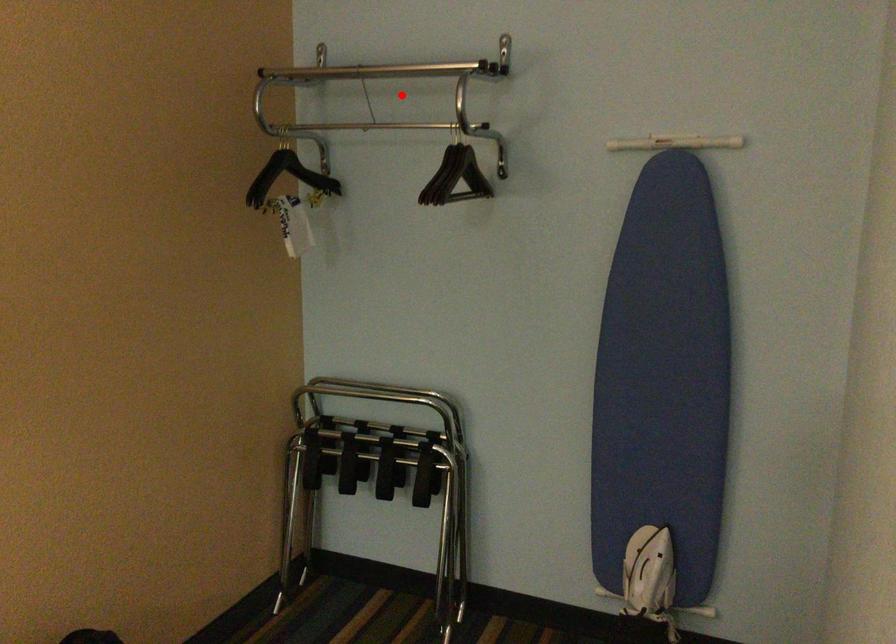
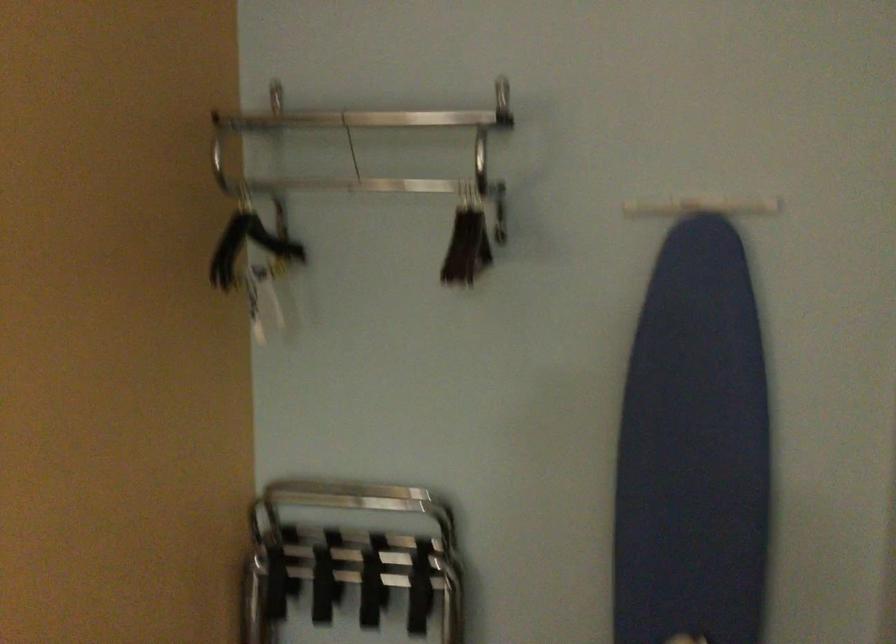
Question: I am providing you with two images of the same scene from different viewpoints. In image1, a red point is highlighted. Considering the same 3D point in image2, which of the following is correct?

Choices:
 (A) It is closer
 (B) It is farther

Answer: (A)